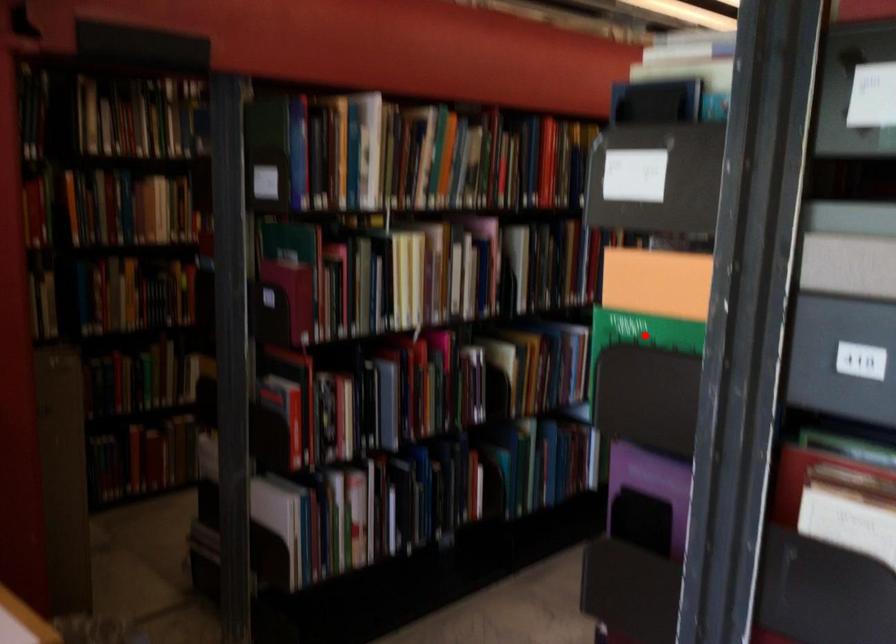
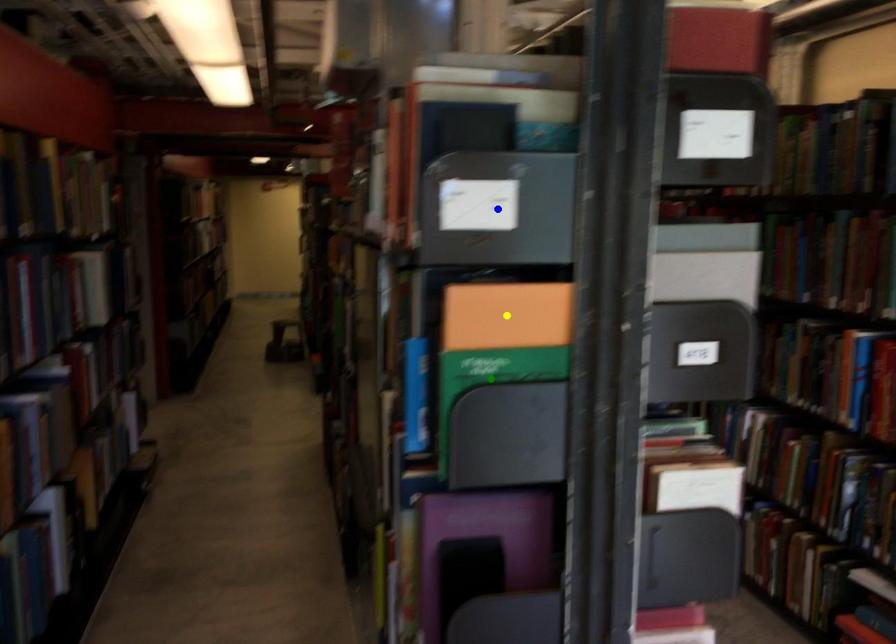
Question: I am providing you with two images of the same scene from different viewpoints. A red point is marked on the first image. You are given multiple points on the second image. Can you choose the point in image 2 that corresponds to the point in image 1?

Choices:
 (A) green point
 (B) yellow point
 (C) blue point

Answer: (A)